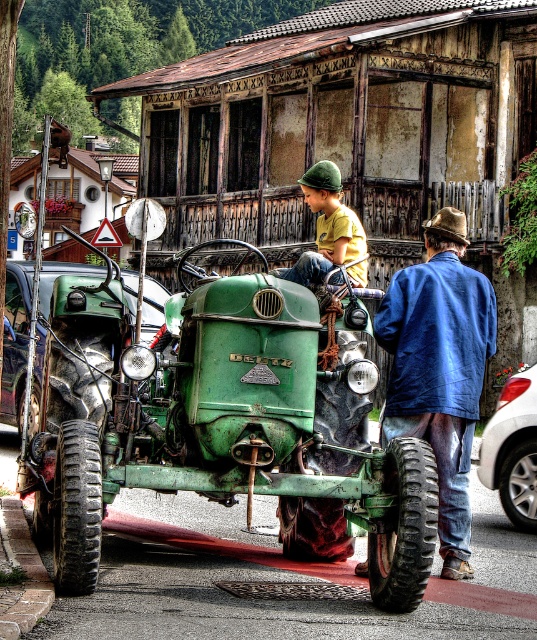
Measure the distance from green matte tractor at center to yellow t-shirt at center.

They are 3.82 feet apart.

Between green matte tractor at center and yellow t-shirt at center, which one appears on the left side from the viewer's perspective?

green matte tractor at center is more to the left.

Locate an element on the screen. The width and height of the screenshot is (537, 640). green matte tractor at center is located at coordinates coord(221,424).

Is blue corduroy jacket at center to the left of yellow t-shirt at center from the viewer's perspective?

In fact, blue corduroy jacket at center is to the right of yellow t-shirt at center.

Which is above, blue corduroy jacket at center or yellow t-shirt at center?

yellow t-shirt at center

What do you see at coordinates (439, 369) in the screenshot? I see `blue corduroy jacket at center` at bounding box center [439, 369].

The height and width of the screenshot is (640, 537). What are the coordinates of `blue corduroy jacket at center` in the screenshot? It's located at (439, 369).

Who is positioned more to the right, green matte tractor at center or blue corduroy jacket at center?

From the viewer's perspective, blue corduroy jacket at center appears more on the right side.

Between green matte tractor at center and blue corduroy jacket at center, which one has less height?

green matte tractor at center

This screenshot has height=640, width=537. I want to click on green matte tractor at center, so 221,424.